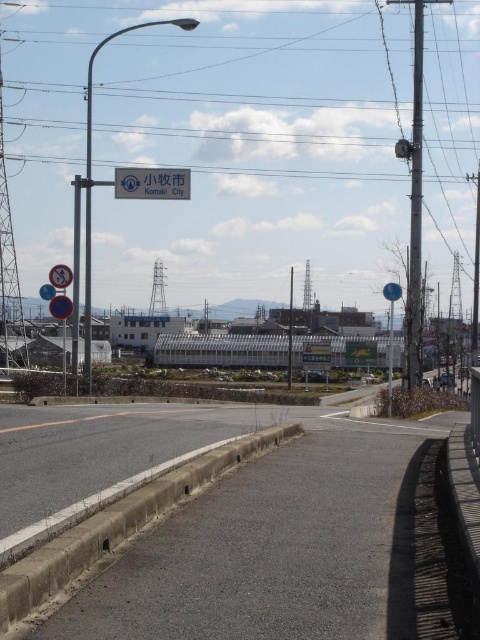
Is gray concrete curb at lower left to the left of metallic pole at right from the viewer's perspective?

Yes, gray concrete curb at lower left is to the left of metallic pole at right.

Is gray concrete curb at lower left to the right of metallic pole at right from the viewer's perspective?

In fact, gray concrete curb at lower left is to the left of metallic pole at right.

Between point (58, 540) and point (415, 344), which one is positioned in front?

Point (58, 540) is in front.

This screenshot has height=640, width=480. I want to click on gray concrete curb at lower left, so click(117, 528).

Does metallic pole at right have a lesser height compared to metallic pole at center?

Incorrect, metallic pole at right's height does not fall short of metallic pole at center's.

Locate an element on the screen. The width and height of the screenshot is (480, 640). metallic pole at right is located at coordinates (415, 209).

Between metallic pole at center and blue plastic sign at left, which one has more height?

Standing taller between the two is metallic pole at center.

Which is behind, point (289, 326) or point (58, 298)?

Positioned behind is point (289, 326).

The height and width of the screenshot is (640, 480). Find the location of `metallic pole at center`. metallic pole at center is located at coordinates (289, 332).

At what (x,y) coordinates should I click in order to perform the action: click on metallic pole at center. Please return your answer as a coordinate pair (x, y). Image resolution: width=480 pixels, height=640 pixels. Looking at the image, I should click on (289, 332).